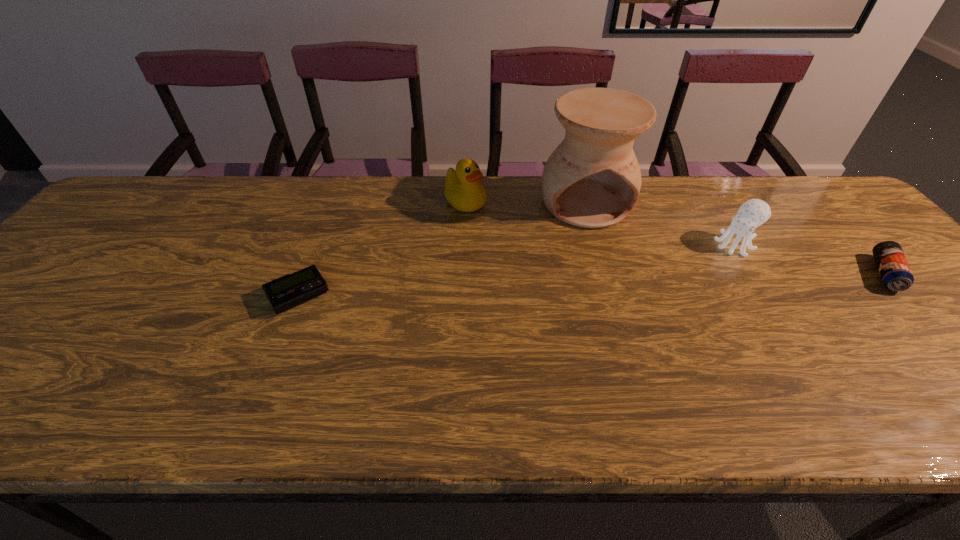
Identify the location of free location located 0.120m on the back of the beeper. Image resolution: width=960 pixels, height=540 pixels. (319, 243).

Locate an element on the screen. This screenshot has height=540, width=960. vacant space positioned on the back of the beer can is located at coordinates (845, 230).

Where is `vacant space located 0.180m on the front-facing side of the octopus`? This screenshot has height=540, width=960. vacant space located 0.180m on the front-facing side of the octopus is located at coordinates (683, 283).

Image resolution: width=960 pixels, height=540 pixels. I want to click on vacant space located 0.370m on the front-facing side of the octopus, so click(633, 320).

Locate an element on the screen. The height and width of the screenshot is (540, 960). blank area located 0.230m on the front-facing side of the octopus is located at coordinates (670, 292).

Find the location of a particular element. free location located 0.280m at the beak of the fourth object from right to left is located at coordinates (550, 265).

I want to click on vacant space located at the beak of the fourth object from right to left, so click(x=539, y=256).

Image resolution: width=960 pixels, height=540 pixels. In order to click on vacant space located at the beak of the fourth object from right to left in this screenshot , I will do pos(577,284).

You are a GUI agent. You are given a task and a screenshot of the screen. Output one action in this format:
    pyautogui.click(x=<x>, y=<y>)
    Task: Click on the free location located 0.270m at the open side of the tallest object
    Image resolution: width=960 pixels, height=540 pixels.
    Given the screenshot: What is the action you would take?
    pyautogui.click(x=629, y=303)

I want to click on vacant space located at the open side of the tallest object, so click(629, 303).